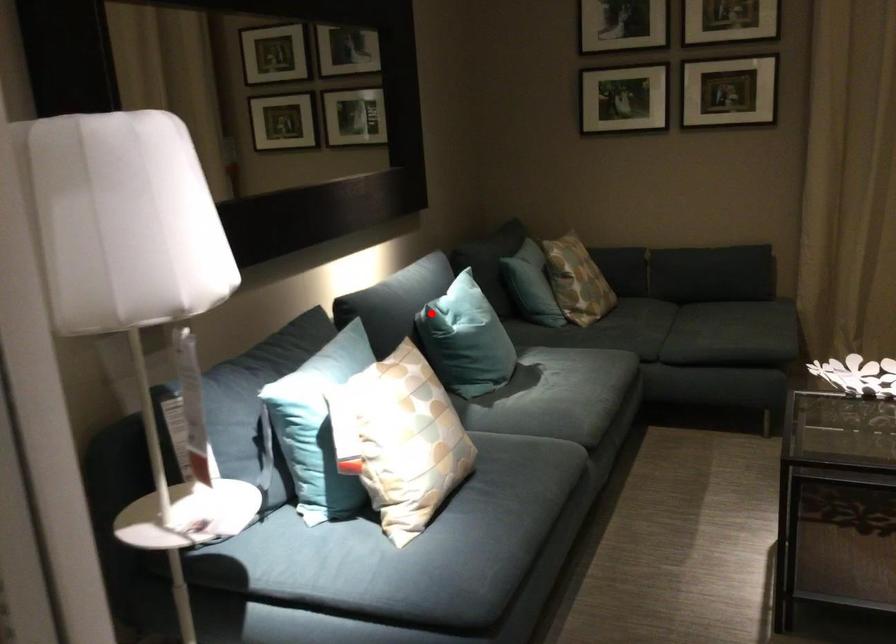
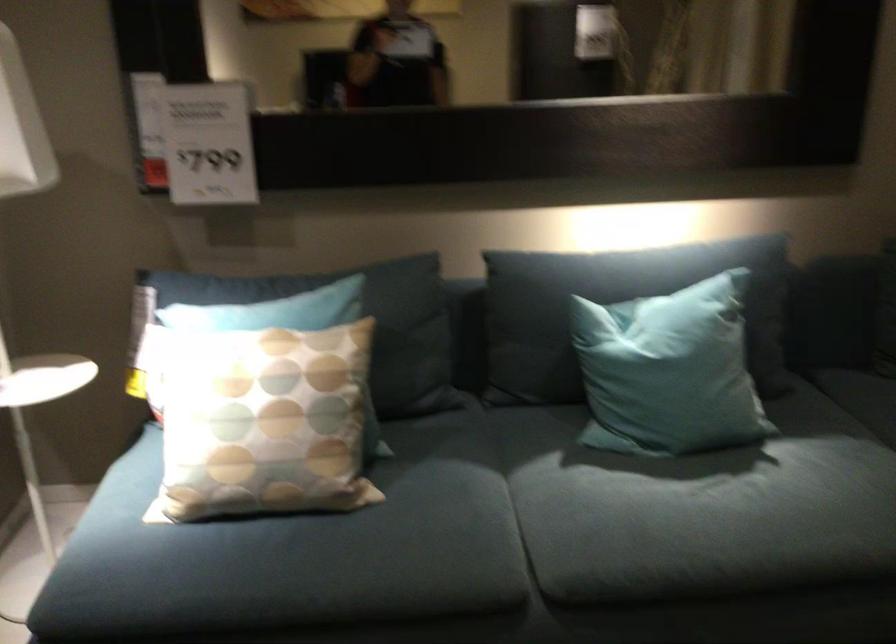
Find the pixel in the second image that matches the highlighted location in the first image.

(616, 308)